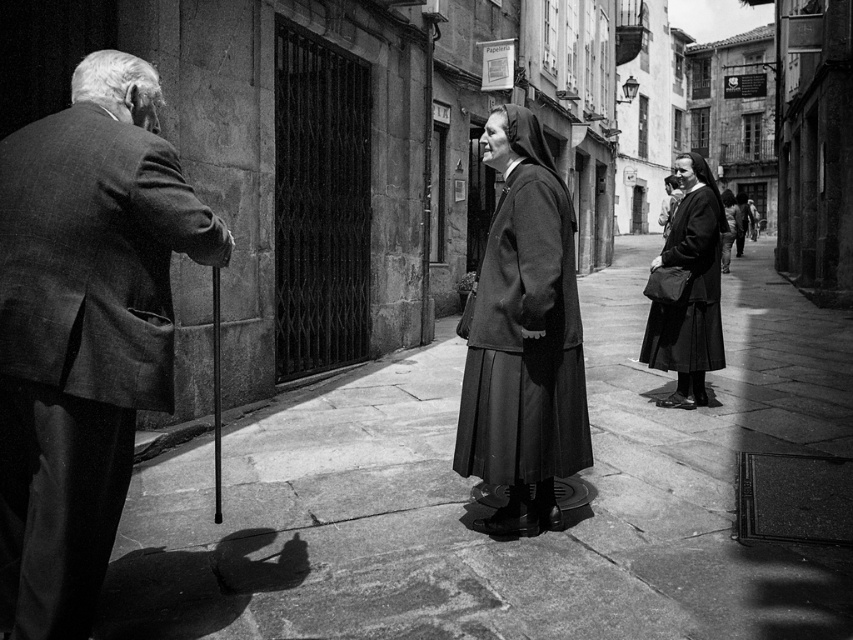
You are a fashion designer observing a historical street scene. You notice the textured wool suit at left and the matte black dress at center. How far apart are these two clothing items in meters?

The textured wool suit at left and the matte black dress at center are 4.87 meters apart.

You are standing in the middle of the street in this historical European town scene. You notice the smooth stone pavement at center and the matte black dress at center. Which object is closer to your eye level?

The matte black dress at center is closer to your eye level because it is taller than the smooth stone pavement at center.